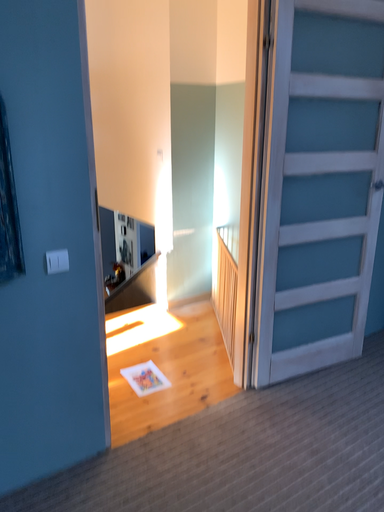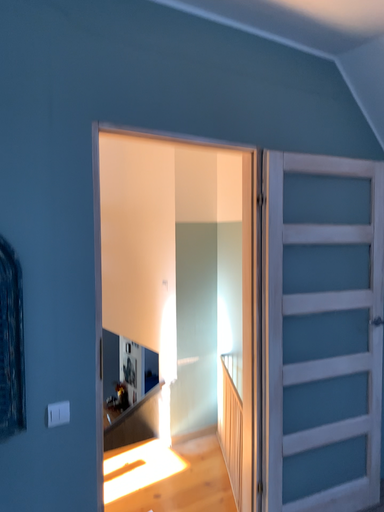
Question: How did the camera likely rotate when shooting the video?

Choices:
 (A) rotated downward
 (B) rotated upward

Answer: (B)